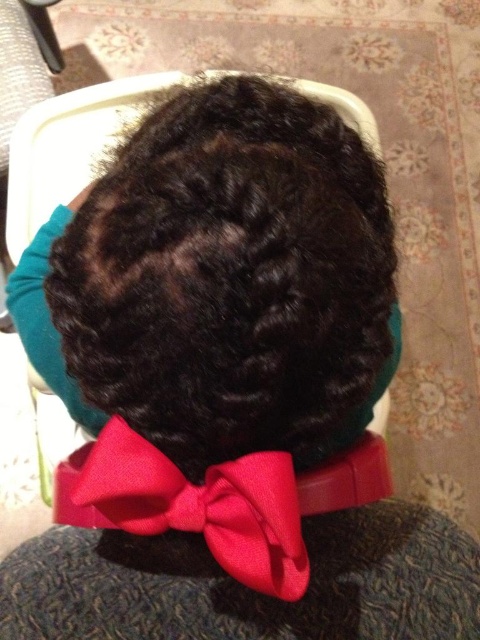
Is curly dark brown hair at center bigger than shiny red bow tie at center?

Yes.

Does curly dark brown hair at center have a greater width compared to shiny red bow tie at center?

Correct, the width of curly dark brown hair at center exceeds that of shiny red bow tie at center.

Is point (255, 413) in front of point (210, 548)?

Yes, it is in front of point (210, 548).

This screenshot has width=480, height=640. I want to click on curly dark brown hair at center, so click(x=231, y=276).